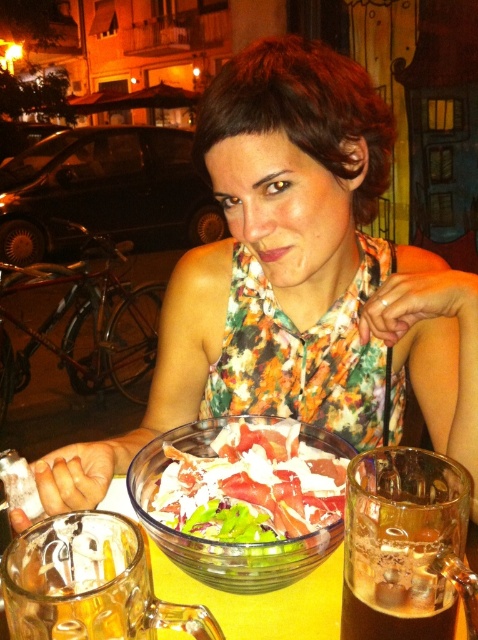
Question: Which object is positioned closest to the yellow glass table at center?

Choices:
 (A) translucent glass mug at lower right
 (B) translucent glass bowl at center

Answer: (B)

Question: Which of these objects is positioned closest to the translucent glass bowl at center?

Choices:
 (A) translucent glass mug at lower right
 (B) yellow glass table at center

Answer: (B)

Question: Can you confirm if translucent glass bowl at center is positioned above yellow glass table at center?

Choices:
 (A) no
 (B) yes

Answer: (B)

Question: Considering the real-world distances, which object is closest to the translucent glass mug at lower right?

Choices:
 (A) yellow glass table at center
 (B) translucent glass bowl at center

Answer: (B)

Question: Is translucent glass mug at lower right to the right of yellow glass table at center from the viewer's perspective?

Choices:
 (A) yes
 (B) no

Answer: (A)

Question: Can you confirm if translucent glass mug at lower right is positioned to the left of yellow glass table at center?

Choices:
 (A) yes
 (B) no

Answer: (B)